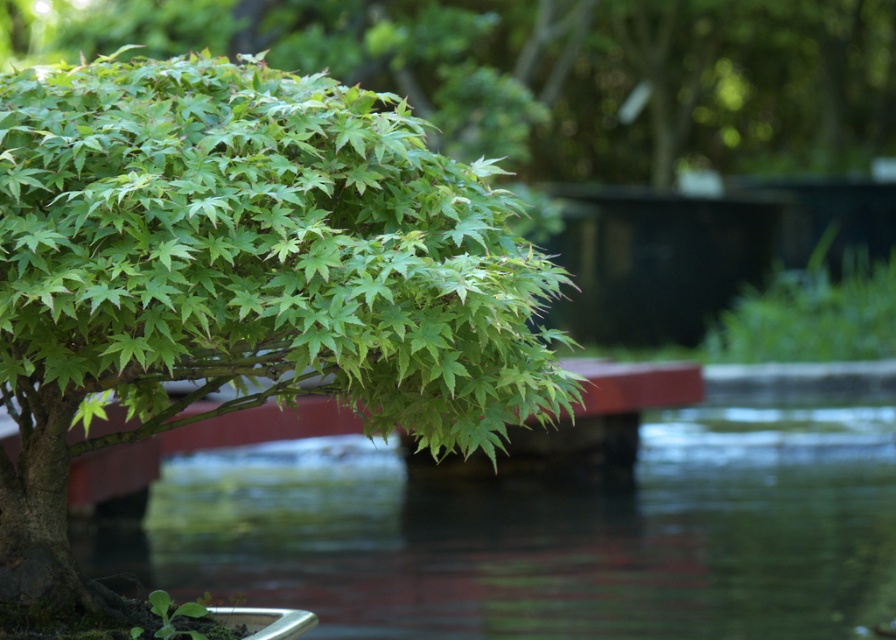
You are standing in the garden scene and want to take a photo of the green leafy tree at left. If you move 0.1 units to the right along the x and y axes, will the tree still be in your frame?

The green leafy tree at left is located at point (240, 278). Moving 0.1 units to the right along both axes would shift your position to approximately (330, 342). Since the tree is at (240, 278), it might still be within the frame depending on the camera angle and zoom, but the exact visibility cannot be determined without additional information about the camera parameters.

Looking at this image, you are a gardener who needs to place a 20 feet long decorative fence between the green leafy tree at left and the transparent water at lower center. Can you fit the fence between them without bending it?

The distance between the green leafy tree at left and the transparent water at lower center is 19.91 feet, which is slightly shorter than the 20 feet fence. Therefore, the fence cannot be placed straight between them without bending it.

You are standing in the garden and want to take a photo of the transparent water at lower center without the green leafy tree at left blocking the view. Which direction should you move to ensure the tree is out of the frame?

You should move to the right side of the transparent water at lower center because the green leafy tree at left is positioned to its left, so moving right would place the tree out of the frame.